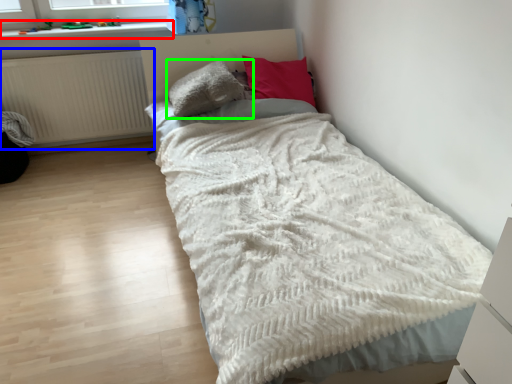
Question: Estimate the real-world distances between objects in this image. Which object is farther from window sill (highlighted by a red box), radiator (highlighted by a blue box) or pillow (highlighted by a green box)?

Choices:
 (A) radiator
 (B) pillow

Answer: (B)